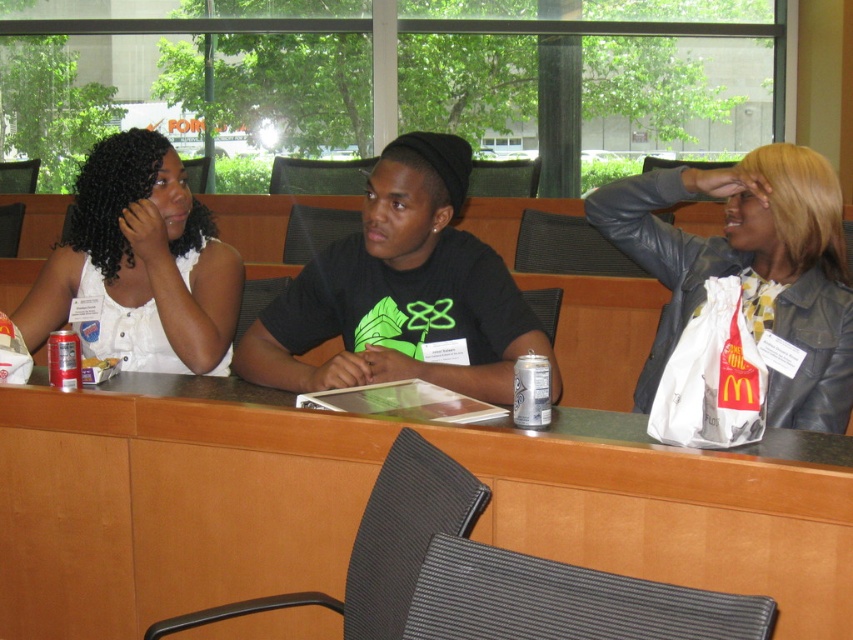
Who is taller, green matte table at center or black leather jacket at upper right?

black leather jacket at upper right

Is green matte table at center shorter than black leather jacket at upper right?

Indeed, green matte table at center has a lesser height compared to black leather jacket at upper right.

Does point (653, 536) lie in front of point (654, 260)?

Yes, it is.

What are the coordinates of `green matte table at center` in the screenshot? It's located at point(366,497).

Which is more to the right, green matte table at center or white matte shirt at upper left?

From the viewer's perspective, green matte table at center appears more on the right side.

Which is above, green matte table at center or white matte shirt at upper left?

white matte shirt at upper left is higher up.

Who is more forward, (119, 625) or (91, 198)?

Positioned in front is point (119, 625).

At what (x,y) coordinates should I click in order to perform the action: click on green matte table at center. Please return your answer as a coordinate pair (x, y). The image size is (853, 640). Looking at the image, I should click on (366, 497).

This screenshot has width=853, height=640. Describe the element at coordinates (366, 497) in the screenshot. I see `green matte table at center` at that location.

Is green matte table at center positioned before black matte shirt at center?

That is True.

Does point (126, 444) come farther from viewer compared to point (404, 161)?

That is False.

Identify the location of green matte table at center. (366, 497).